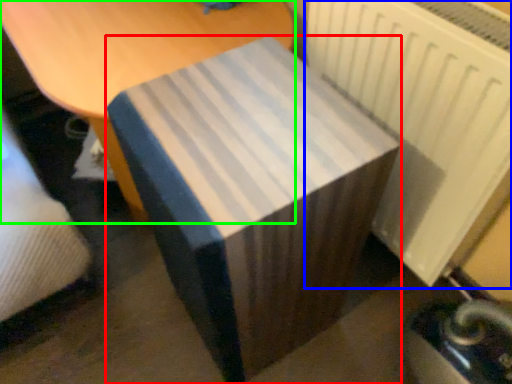
Question: Which is nearer to the table (highlighted by a red box)? radiator (highlighted by a blue box) or furniture (highlighted by a green box).

Choices:
 (A) radiator
 (B) furniture

Answer: (A)